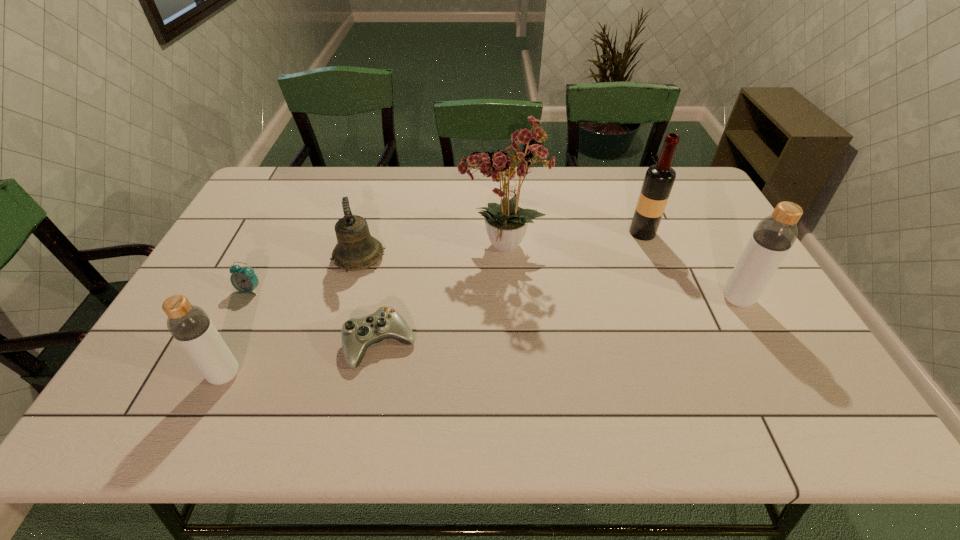
Image resolution: width=960 pixels, height=540 pixels. I want to click on control positioned at the near edge, so click(x=358, y=334).

Find the location of a particular element. This screenshot has width=960, height=540. bottle situated at the left edge is located at coordinates (190, 326).

I want to click on alarm clock at the left edge, so 244,280.

Locate an element on the screen. The height and width of the screenshot is (540, 960). object that is positioned at the right edge is located at coordinates (774, 235).

You are a GUI agent. You are given a task and a screenshot of the screen. Output one action in this format:
    pyautogui.click(x=<x>, y=<y>)
    Task: Click on the object positioned at the near left corner
    
    Given the screenshot: What is the action you would take?
    pyautogui.click(x=190, y=326)

Find the location of a particular element. The height and width of the screenshot is (540, 960). vacant space at the far edge of the desktop is located at coordinates (444, 181).

What are the coordinates of `vacant region at the near edge` in the screenshot? It's located at (723, 368).

Where is `free spot at the left edge of the desktop`? The height and width of the screenshot is (540, 960). free spot at the left edge of the desktop is located at coordinates (271, 222).

At what (x,y) coordinates should I click in order to perform the action: click on free space at the right edge of the desktop. Please return your answer as a coordinate pair (x, y). Looking at the image, I should click on (704, 261).

Locate an element on the screen. The width and height of the screenshot is (960, 540). vacant space at the far left corner of the desktop is located at coordinates (291, 179).